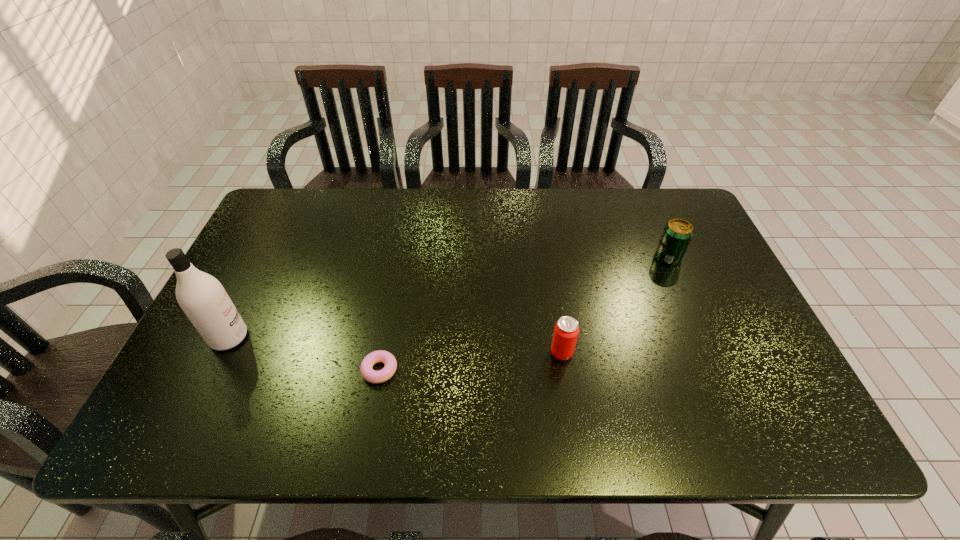
You are a GUI agent. You are given a task and a screenshot of the screen. Output one action in this format:
    pyautogui.click(x=<x>, y=<y>)
    Task: Click on the third closest object to the third object from right to left
    
    Given the screenshot: What is the action you would take?
    pyautogui.click(x=677, y=234)

What are the coordinates of `the third closest object relative to the left beer can` in the screenshot? It's located at (202, 297).

Locate an element on the screen. vacant area that satisfies the following two spatial constraints: 1. on the front-facing side of the second object from left to right; 2. on the left side of the leftmost object is located at coordinates (213, 370).

This screenshot has width=960, height=540. Find the location of `free region that satisfies the following two spatial constraints: 1. on the back side of the rightmost object; 2. on the left side of the nearer beer can`. free region that satisfies the following two spatial constraints: 1. on the back side of the rightmost object; 2. on the left side of the nearer beer can is located at coordinates (547, 256).

At what (x,y) coordinates should I click in order to perform the action: click on free space that satisfies the following two spatial constraints: 1. on the front-facing side of the leftmost object; 2. on the left side of the third object from left to right. Please return your answer as a coordinate pair (x, y). This screenshot has width=960, height=540. Looking at the image, I should click on (222, 353).

This screenshot has height=540, width=960. Find the location of `free space that satisfies the following two spatial constraints: 1. on the back side of the second object from left to right; 2. on the front-facing side of the leftmost object`. free space that satisfies the following two spatial constraints: 1. on the back side of the second object from left to right; 2. on the front-facing side of the leftmost object is located at coordinates (385, 338).

In order to click on vacant space that satisfies the following two spatial constraints: 1. on the back side of the farthest object; 2. on the left side of the third object from left to right in this screenshot , I will do `click(547, 256)`.

Locate an element on the screen. free space that satisfies the following two spatial constraints: 1. on the front-facing side of the tallest object; 2. on the left side of the second object from right to left is located at coordinates (222, 353).